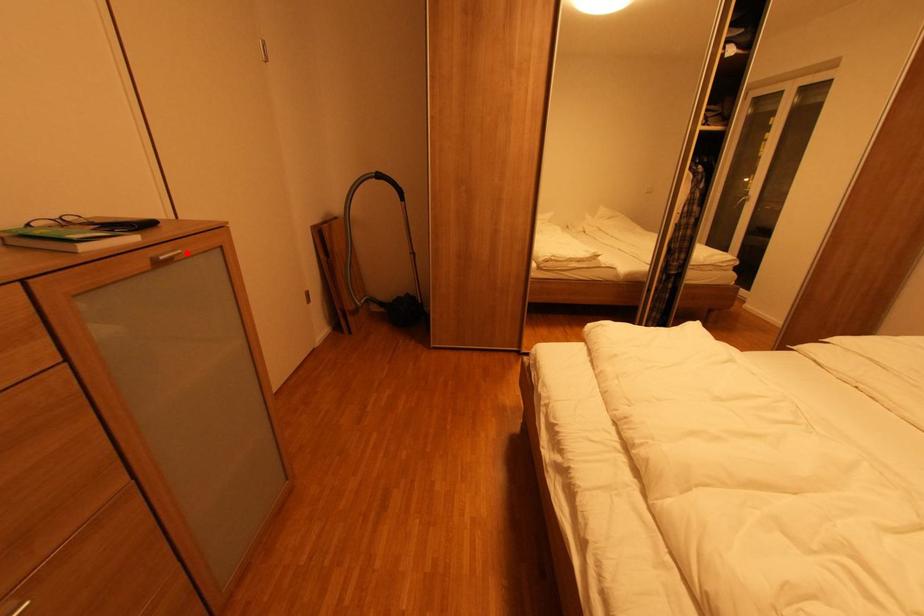
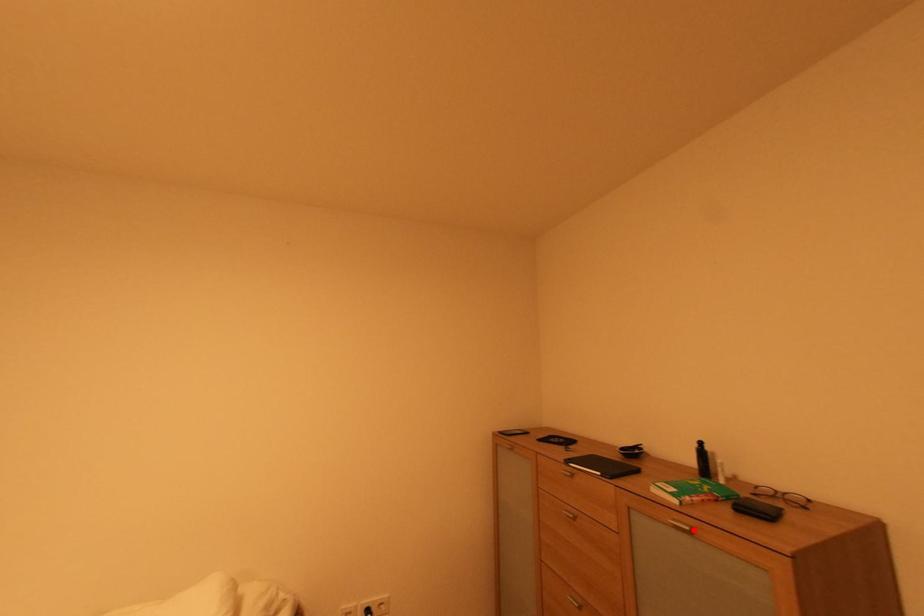
I am providing you with two images of the same scene from different viewpoints. A red point is marked on the first image and another point is marked on the second image. Are the points marked in image1 and image2 representing the same 3D position?

Yes